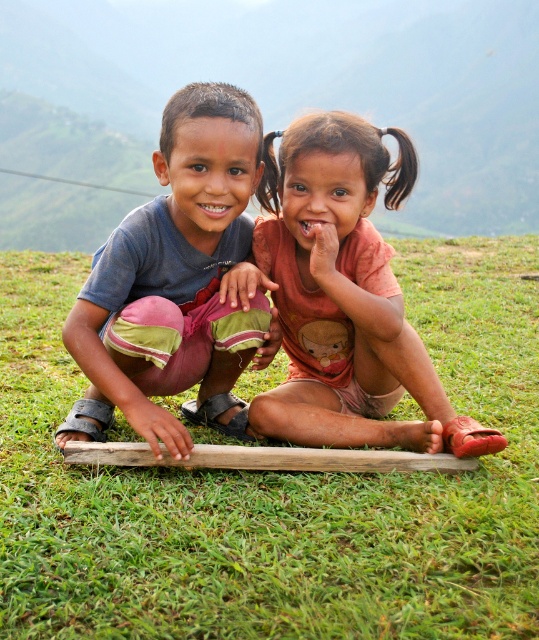
Question: Which object is closer to the camera taking this photo?

Choices:
 (A) green grassy at center
 (B) orange cotton shirt at center
 (C) green grass at lower center

Answer: (A)

Question: Is green grass at lower center smaller than matte blue shirt at center?

Choices:
 (A) no
 (B) yes

Answer: (A)

Question: Considering the real-world distances, which object is closest to the matte blue shirt at center?

Choices:
 (A) green grass at lower center
 (B) orange cotton shirt at center

Answer: (B)

Question: Which of the following is the farthest from the observer?

Choices:
 (A) (314, 136)
 (B) (425, 173)
 (C) (142, 259)
 (D) (515, 531)

Answer: (B)

Question: Is green grassy at center bigger than matte blue shirt at center?

Choices:
 (A) no
 (B) yes

Answer: (A)

Question: Is green grassy at center thinner than matte blue shirt at center?

Choices:
 (A) no
 (B) yes

Answer: (A)